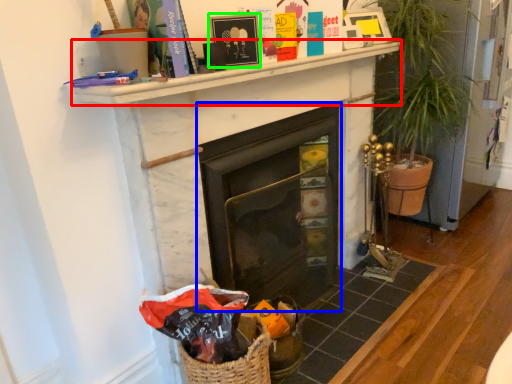
Question: Which object is positioned farthest from mantle (highlighted by a red box)? Select from fireplace (highlighted by a blue box) and picture frame (highlighted by a green box).

Choices:
 (A) fireplace
 (B) picture frame

Answer: (A)